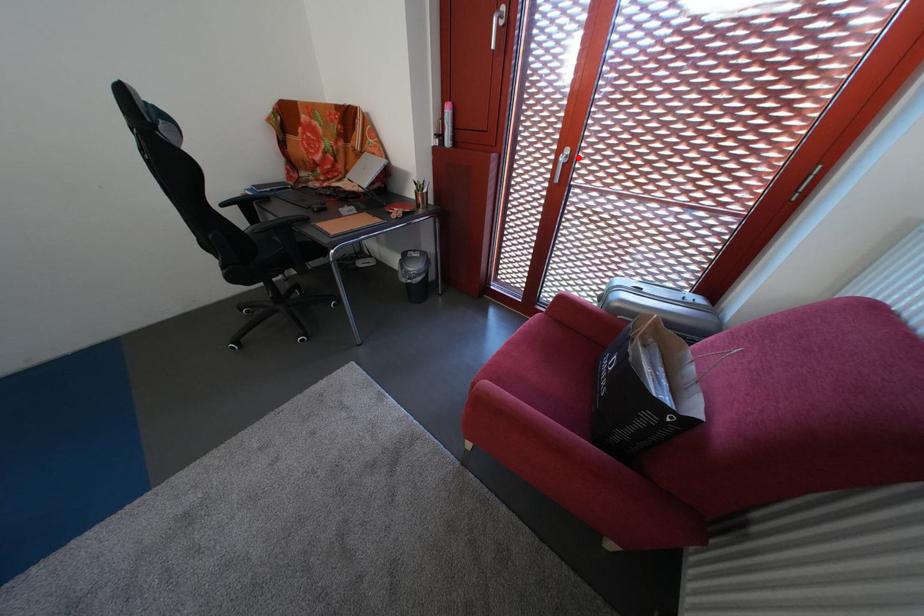
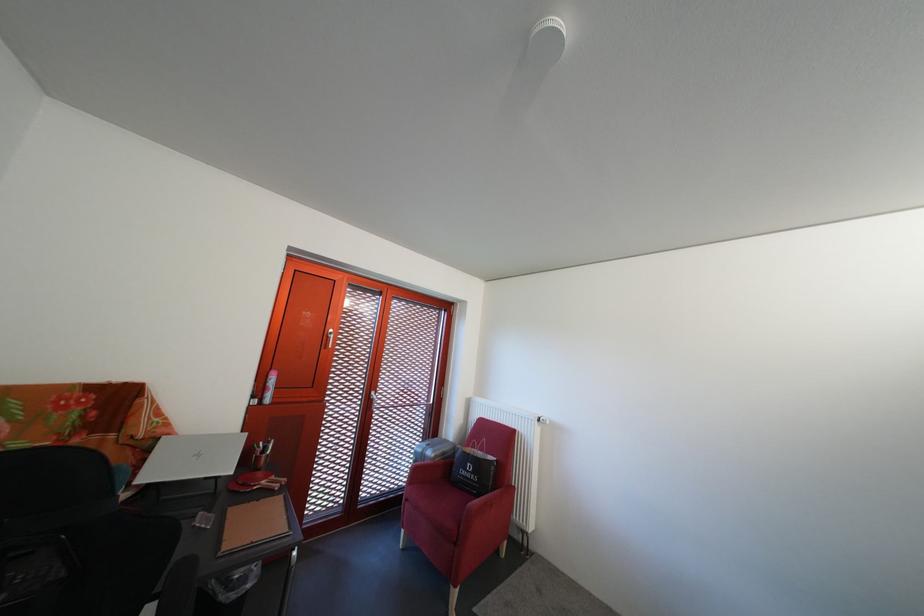
Question: I am providing you with two images of the same scene from different viewpoints. Image1 has a red point marked. In image2, the corresponding 3D location appears at what relative position? Reply with the corresponding letter.

Choices:
 (A) Closer
 (B) Farther

Answer: (B)